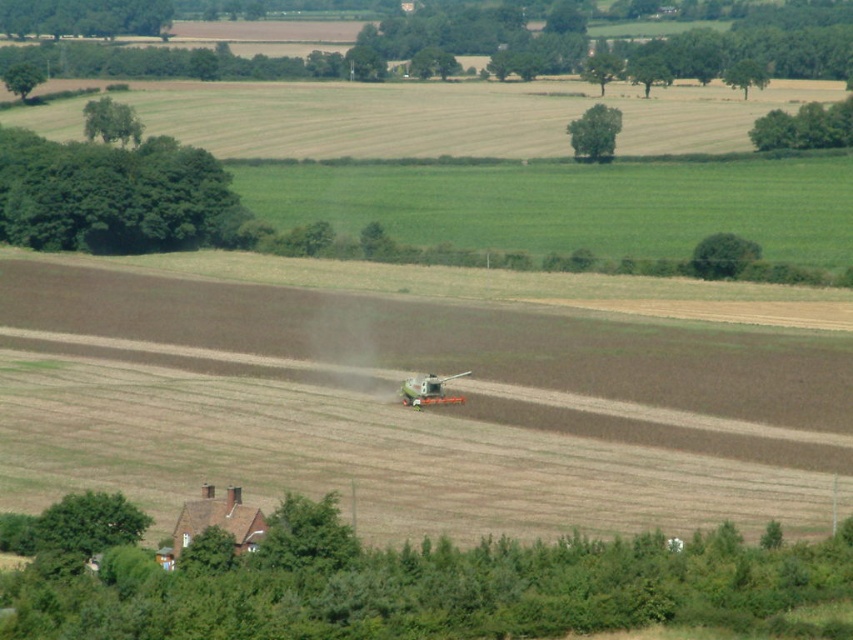
Does brown soil at center have a lesser width compared to metallic orange agricultural equipment at center?

No, brown soil at center is not thinner than metallic orange agricultural equipment at center.

Which is behind, point (224, 298) or point (425, 396)?

Point (224, 298)

Does point (16, 436) come closer to viewer compared to point (432, 372)?

Yes, it is in front of point (432, 372).

The width and height of the screenshot is (853, 640). In order to click on brown soil at center in this screenshot , I will do tap(410, 410).